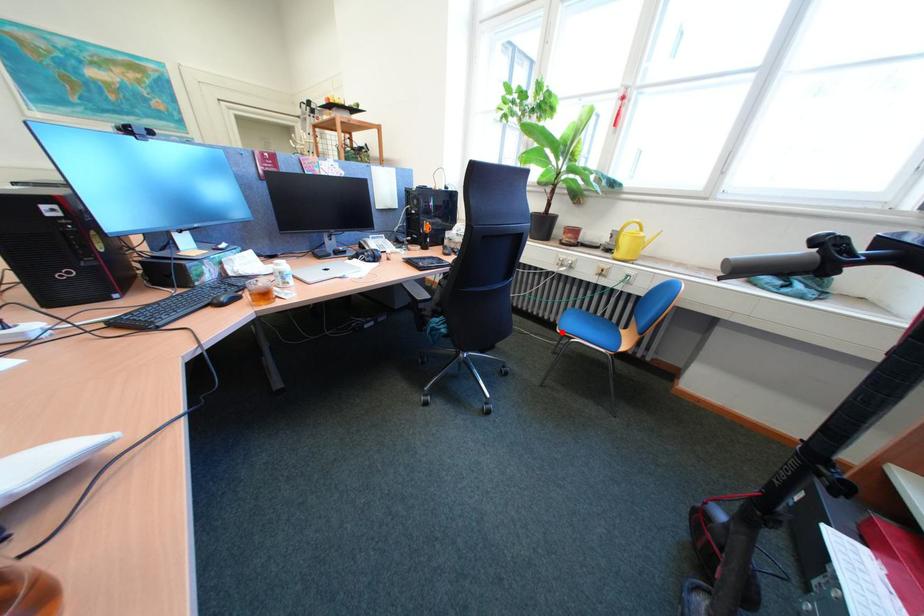
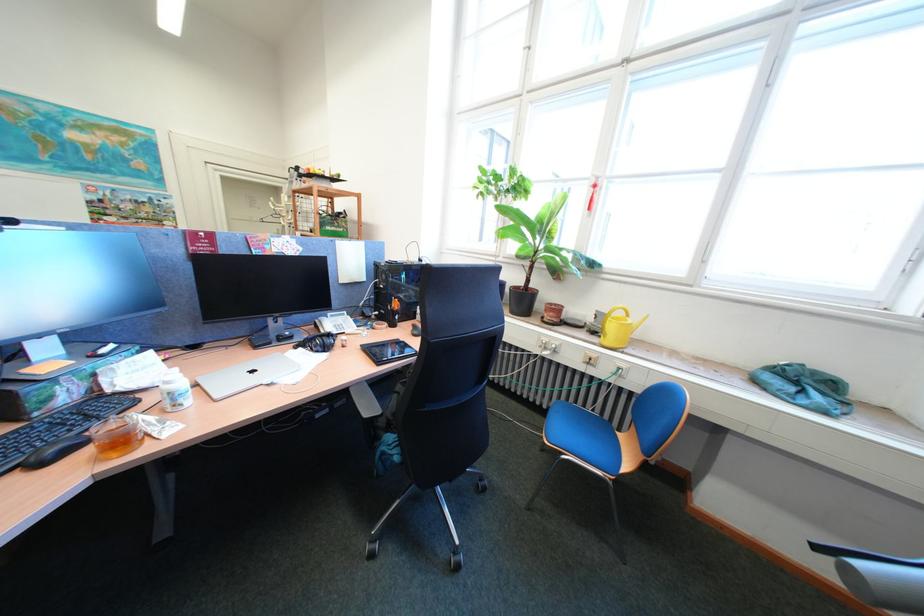
Question: I am providing you with two images of the same scene from different viewpoints. A red point is shown in image1. For the corresponding object point in image2, is it positioned nearer or farther from the camera?

Choices:
 (A) Nearer
 (B) Farther

Answer: (B)